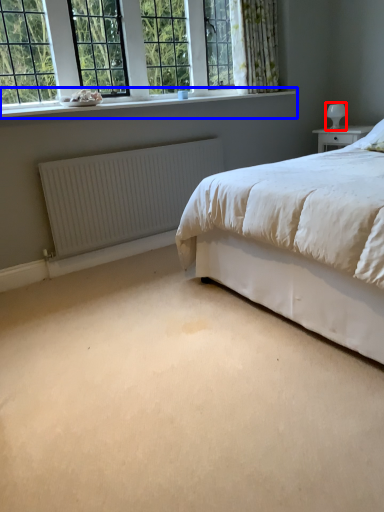
Question: Which object appears farthest to the camera in this image, table lamp (highlighted by a red box) or window sill (highlighted by a blue box)?

Choices:
 (A) table lamp
 (B) window sill

Answer: (A)